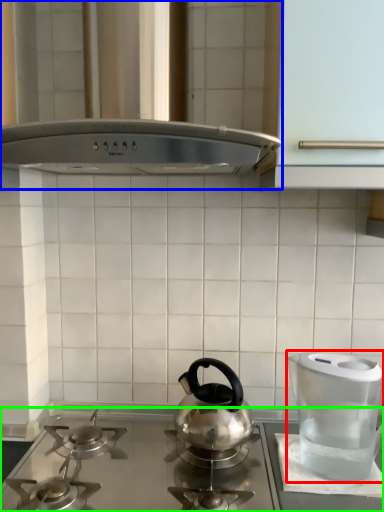
Question: Which is nearer to the kitchen appliance (highlighted by a red box)? vent (highlighted by a blue box) or gas stove (highlighted by a green box).

Choices:
 (A) vent
 (B) gas stove

Answer: (B)